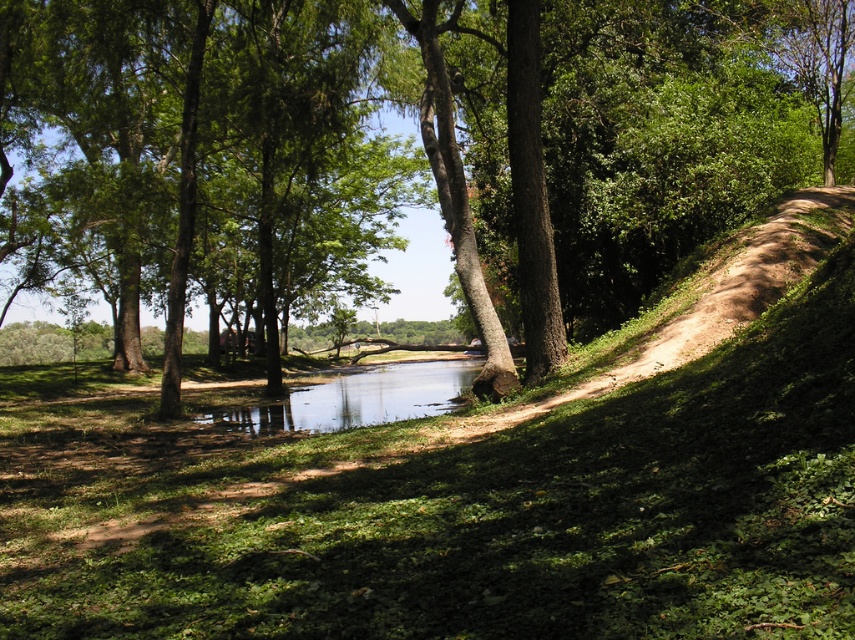
You are standing at the edge of the river and want to walk to the dirt path on the embankment. The green grassy hillside at lower right is in your way. If your stride length is 0.75 meters, how many steps do you need to take to reach the dirt path?

The green grassy hillside at lower right is 2.22 meters from camera. Since each step is 0.75 meters, you would need approximately 3 steps to cover the distance, as 2.22 divided by 0.75 equals roughly 2.96, which rounds up to 3 steps.

You are a hiker standing at the base of the green leafy tree at center. You want to reach the dirt path on the embankment at the top of the green grassy hillside at lower right. Which direction should you walk to get there?

The green grassy hillside at lower right is not as tall as the green leafy tree at center, so you should walk towards the green grassy hillside at lower right to reach the dirt path on the embankment at the top since it is shorter in height compared to the tree.

You are standing on the dirt path near the river and want to take a photo of the green leafy tree at center and the clear water at center. Which object should you focus on first if you want to capture both in the same frame without moving the camera?

The green leafy tree at center is above the clear water at center, so you should focus on the green leafy tree at center first to ensure both are in focus.